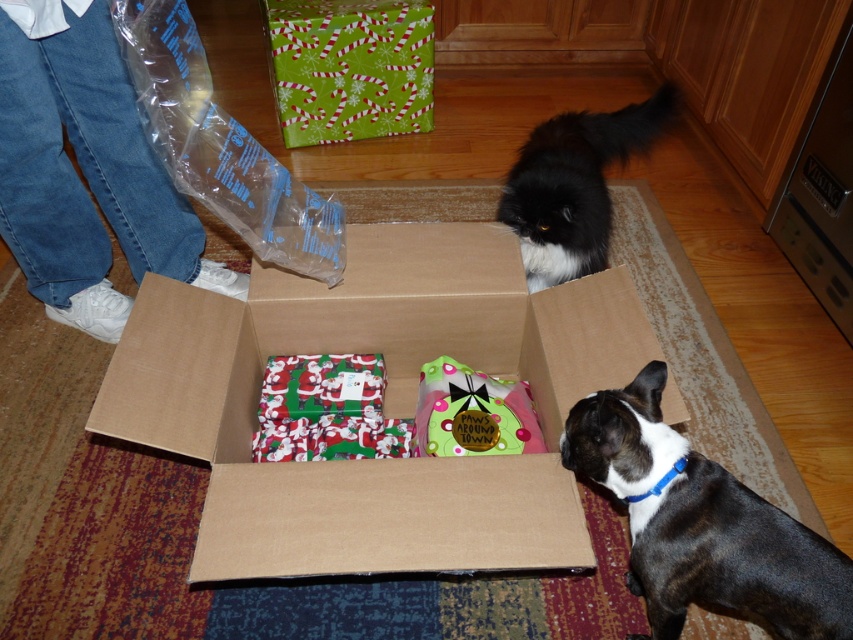
Question: Can you confirm if black fluffy cat at upper center is thinner than matte green fabric gift at center?

Choices:
 (A) yes
 (B) no

Answer: (B)

Question: Which point is farther from the camera taking this photo?

Choices:
 (A) (273, 403)
 (B) (636, 458)
 (C) (347, 560)
 (D) (585, 266)

Answer: (D)

Question: Which object appears farthest from the camera in this image?

Choices:
 (A) matte green fabric gift at center
 (B) green paper wrapped gift at center
 (C) brown cardboard box at center
 (D) black fluffy cat at upper center

Answer: (B)

Question: Which object is positioned closest to the black fluffy cat at upper center?

Choices:
 (A) black smooth dog at lower right
 (B) green paper wrapped gift at center
 (C) santa claus wrapping paper at center

Answer: (C)

Question: Does matte green fabric gift at center have a smaller size compared to santa claus wrapping paper at center?

Choices:
 (A) no
 (B) yes

Answer: (A)

Question: Is black fluffy cat at upper center positioned before santa claus wrapping paper at center?

Choices:
 (A) yes
 (B) no

Answer: (B)